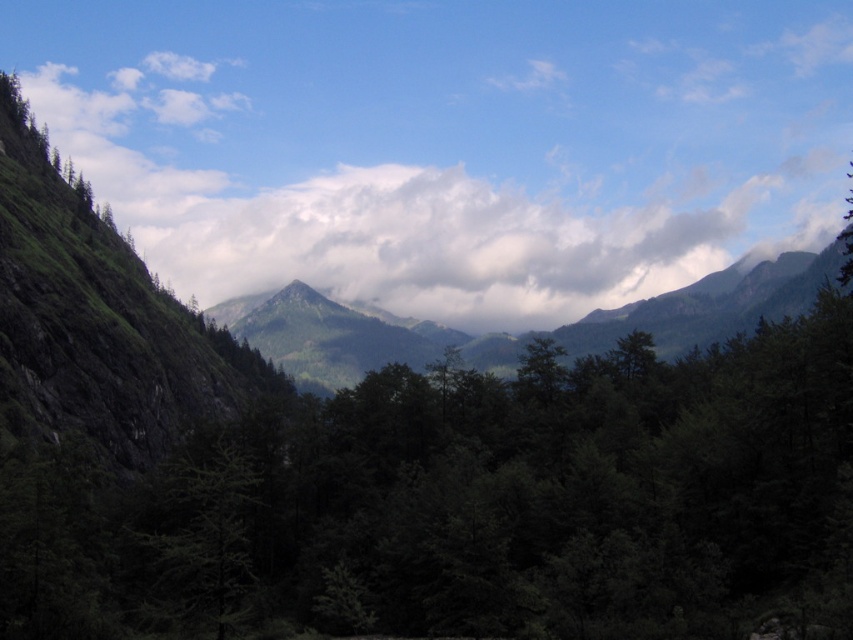
Who is more distant from viewer, [705,589] or [793,276]?

Positioned behind is point [793,276].

From the picture: Is green matte tree at center above green matte mountain at center?

No.

Image resolution: width=853 pixels, height=640 pixels. I want to click on green matte tree at center, so click(x=473, y=506).

Which is in front, point (827, 566) or point (692, 198)?

Point (827, 566)

Who is shorter, green matte tree at center or cloudy sky at upper center?

Standing shorter between the two is green matte tree at center.

Image resolution: width=853 pixels, height=640 pixels. In order to click on green matte tree at center in this screenshot , I will do `click(473, 506)`.

Can you confirm if cloudy sky at upper center is thinner than green matte mountain at center?

No, cloudy sky at upper center is not thinner than green matte mountain at center.

Measure the distance between cloudy sky at upper center and camera.

cloudy sky at upper center is 252.38 meters away from camera.

At what (x,y) coordinates should I click in order to perform the action: click on cloudy sky at upper center. Please return your answer as a coordinate pair (x, y). The width and height of the screenshot is (853, 640). Looking at the image, I should click on (434, 204).